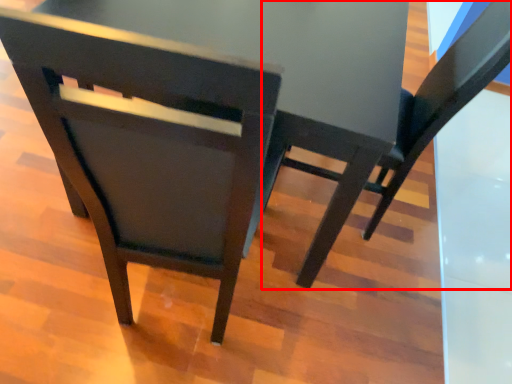
Question: From the image's perspective, considering the relative positions of chair (annotated by the red box) and chair in the image provided, where is chair (annotated by the red box) located with respect to the staircase?

Choices:
 (A) above
 (B) below

Answer: (A)